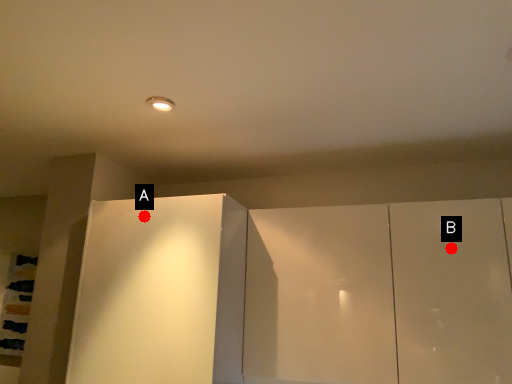
Question: Two points are circled on the image, labeled by A and B beside each circle. Which point is closer to the camera?

Choices:
 (A) A is closer
 (B) B is closer

Answer: (B)